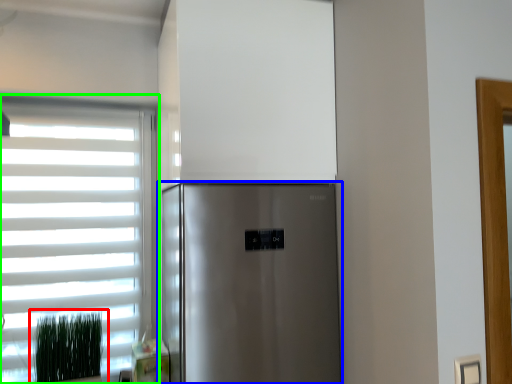
Question: Considering the real-world distances, which object is closest to plant (highlighted by a red box)? refrigerator (highlighted by a blue box) or window (highlighted by a green box).

Choices:
 (A) refrigerator
 (B) window

Answer: (B)